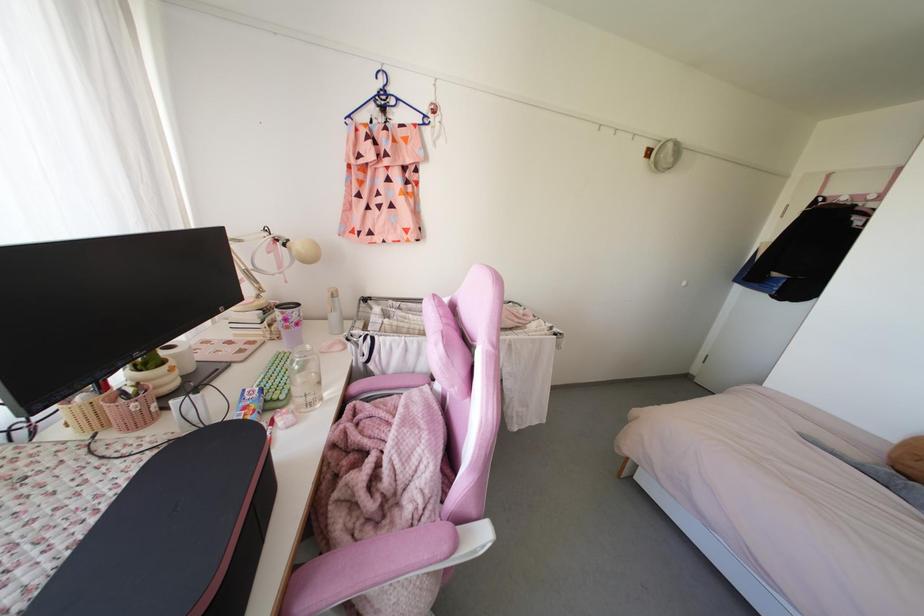
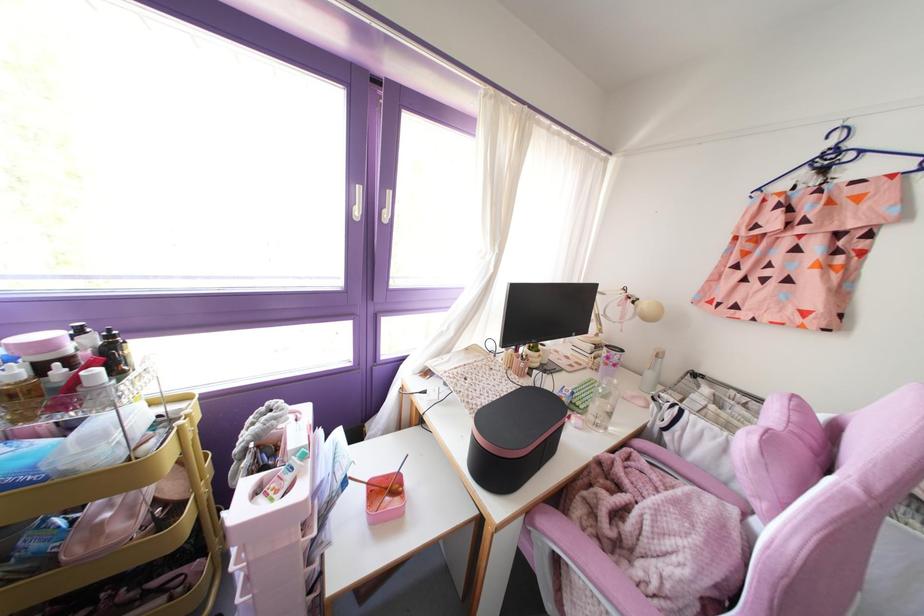
Where in the second image is the point corresponding to point 380,84 from the first image?

(832, 143)